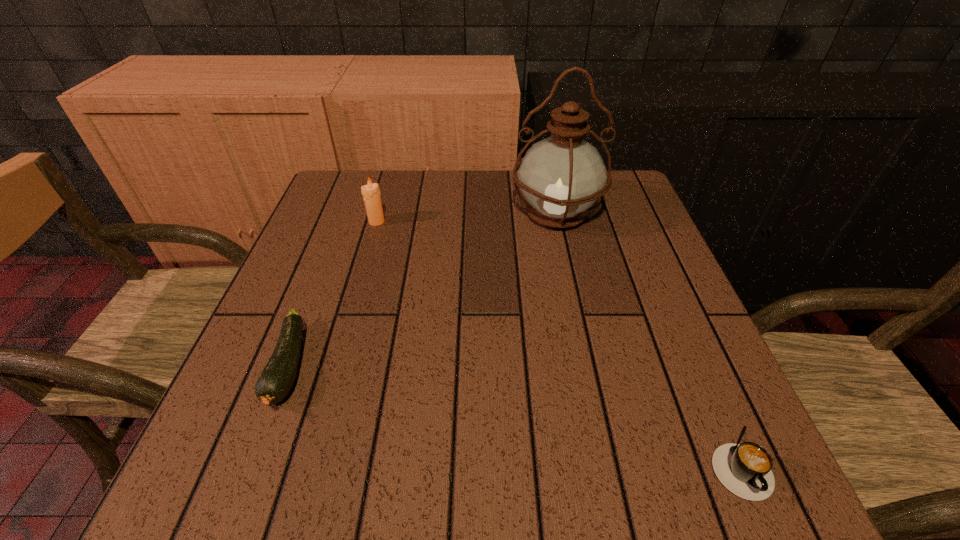
What are the coordinates of `vacant space located at the blossom end of the second nearest object` in the screenshot? It's located at (241, 494).

Where is `oil lamp that is at the far edge`? This screenshot has height=540, width=960. oil lamp that is at the far edge is located at coordinates (561, 176).

The width and height of the screenshot is (960, 540). What are the coordinates of `candle that is at the far edge` in the screenshot? It's located at (371, 193).

Find the location of `object at the near edge`. object at the near edge is located at coordinates (744, 469).

You are a GUI agent. You are given a task and a screenshot of the screen. Output one action in this format:
    pyautogui.click(x=<x>, y=<y>)
    Task: Click on the candle that is at the left edge
    
    Given the screenshot: What is the action you would take?
    pyautogui.click(x=371, y=193)

Identify the location of zucchini situated at the left edge. (276, 379).

At what (x,y) coordinates should I click in order to perform the action: click on oil lamp that is positioned at the right edge. Please return your answer as a coordinate pair (x, y). This screenshot has width=960, height=540. Looking at the image, I should click on (561, 176).

Image resolution: width=960 pixels, height=540 pixels. Find the location of `cappuccino situated at the right edge`. cappuccino situated at the right edge is located at coordinates (744, 469).

Find the location of a particular element. object at the far left corner is located at coordinates (371, 193).

Image resolution: width=960 pixels, height=540 pixels. Identify the location of object that is at the far right corner. (561, 176).